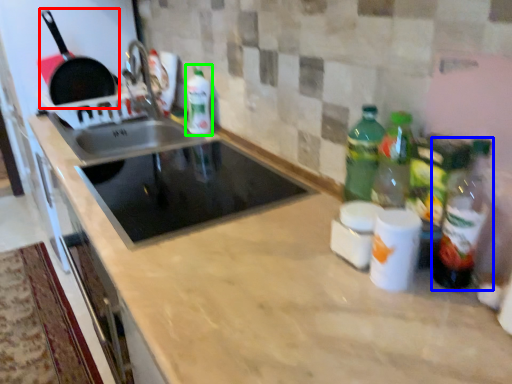
Question: Which object is the farthest from frying pan (highlighted by a red box)? Choose among these: bottle (highlighted by a blue box) or bottle (highlighted by a green box).

Choices:
 (A) bottle
 (B) bottle

Answer: (A)